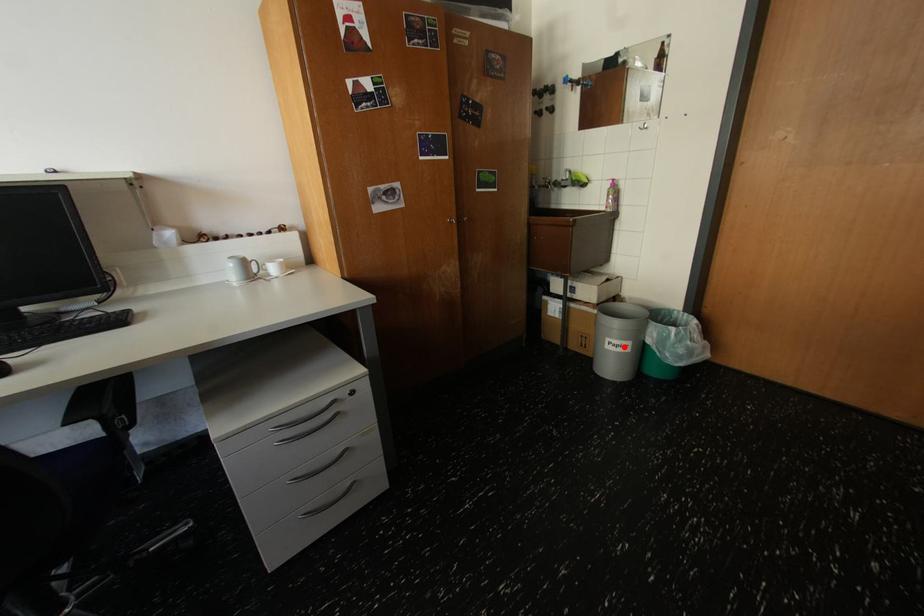
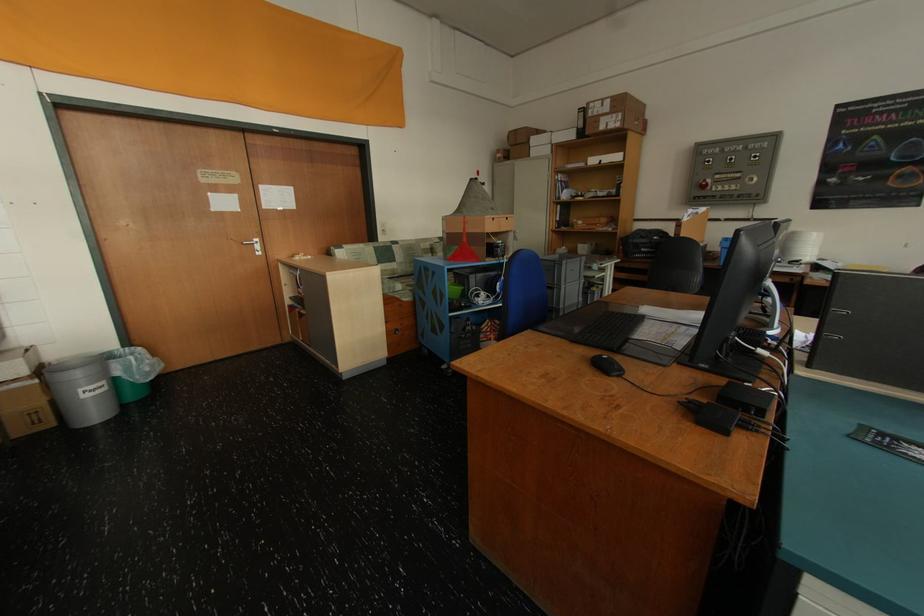
Question: I am providing you with two images of the same scene from different viewpoints. Given a red point in image1, look at the same physical point in image2. Is it:

Choices:
 (A) Closer to the viewpoint
 (B) Farther from the viewpoint

Answer: (A)